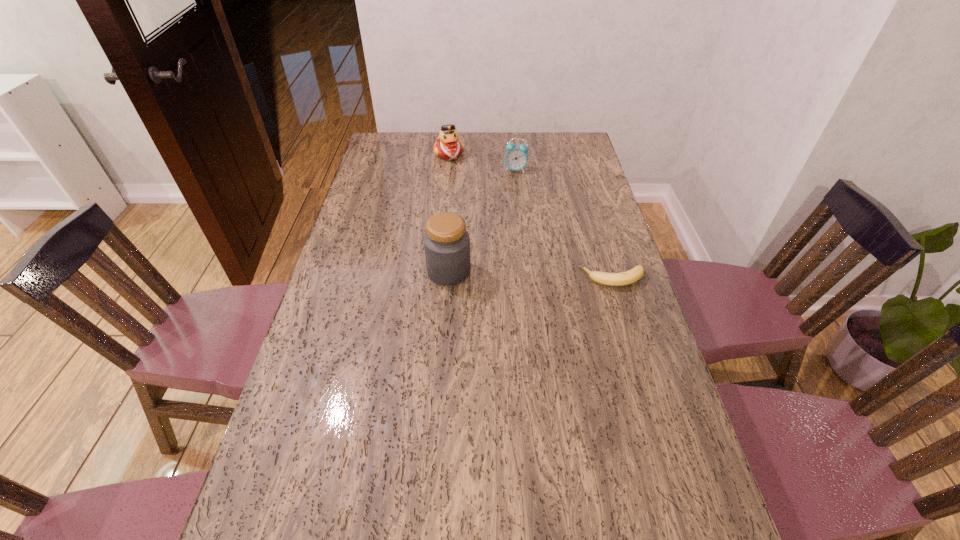
In order to click on vacant space on the desktop that is between the tallest object and the rightmost object and is positioned on the face of the alarm clock in this screenshot , I will do `click(524, 274)`.

Image resolution: width=960 pixels, height=540 pixels. I want to click on vacant space on the desktop that is between the jar and the rightmost object and is positioned on the face of the farthest object, so (516, 274).